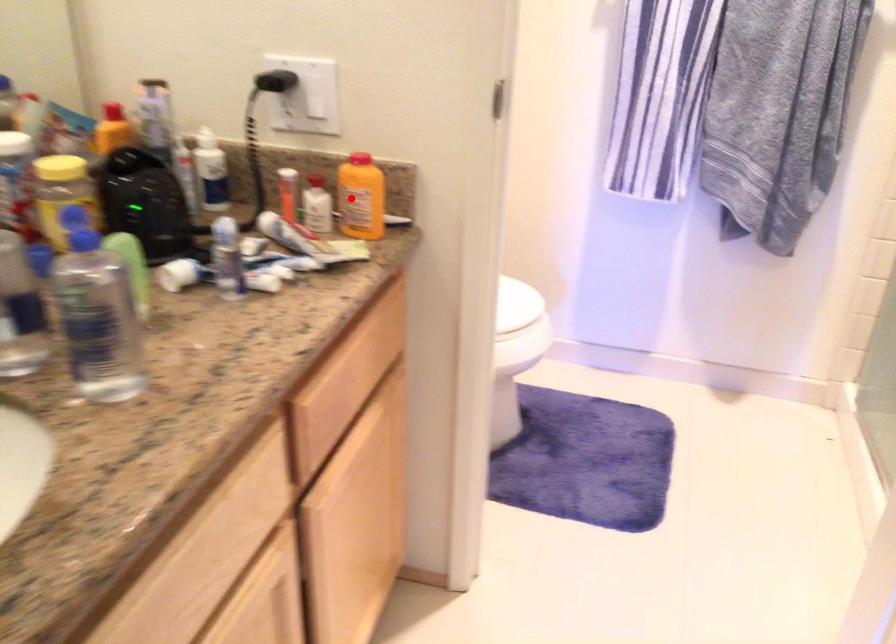
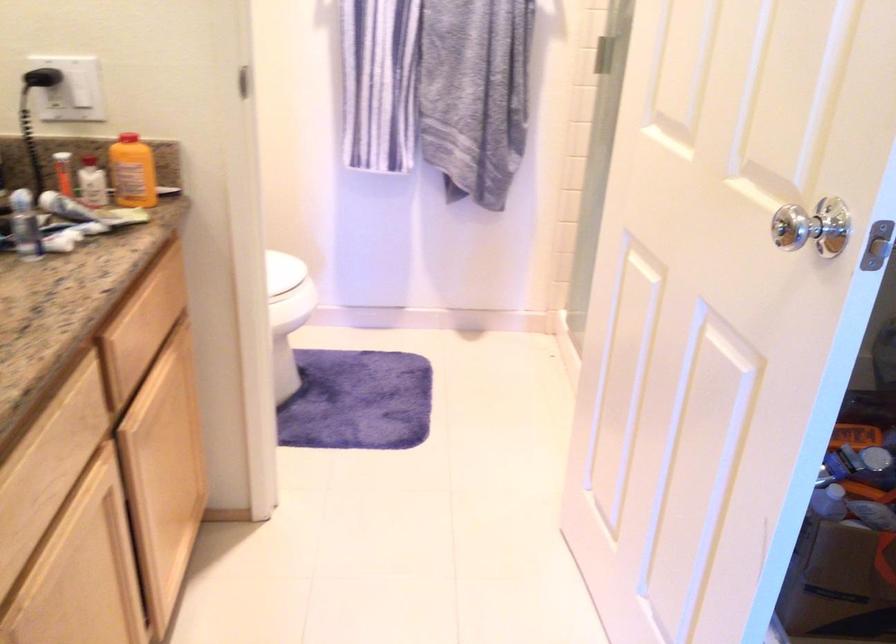
Where in the second image is the point corresponding to the highlighted location from the first image?

(133, 172)